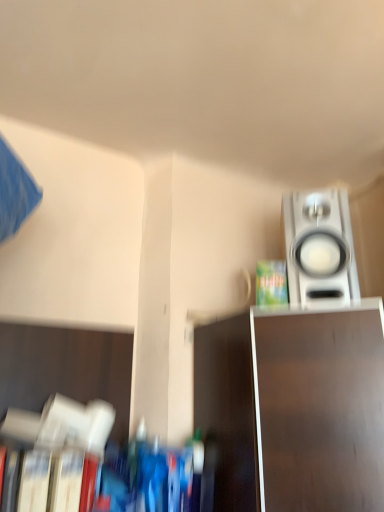
Question: From the image's perspective, is satin silver speaker at upper right over hardcover book at lower left?

Choices:
 (A) no
 (B) yes

Answer: (B)

Question: Can you confirm if satin silver speaker at upper right is thinner than hardcover book at lower left?

Choices:
 (A) yes
 (B) no

Answer: (B)

Question: Is satin silver speaker at upper right far away from hardcover book at lower left?

Choices:
 (A) yes
 (B) no

Answer: (B)

Question: From a real-world perspective, is satin silver speaker at upper right beneath hardcover book at lower left?

Choices:
 (A) no
 (B) yes

Answer: (A)

Question: Is satin silver speaker at upper right facing away from hardcover book at lower left?

Choices:
 (A) no
 (B) yes

Answer: (A)

Question: From a real-world perspective, relative to green matte paperback book at upper right, is satin silver speaker at upper right vertically above or below?

Choices:
 (A) above
 (B) below

Answer: (A)

Question: Based on their sizes in the image, would you say satin silver speaker at upper right is bigger or smaller than green matte paperback book at upper right?

Choices:
 (A) small
 (B) big

Answer: (B)

Question: From the image's perspective, is satin silver speaker at upper right located above or below green matte paperback book at upper right?

Choices:
 (A) above
 (B) below

Answer: (A)

Question: Would you say satin silver speaker at upper right is to the left or to the right of green matte paperback book at upper right in the picture?

Choices:
 (A) right
 (B) left

Answer: (A)

Question: Considering the positions of green matte paperback book at upper right and metallic silver tv stand at lower right in the image, is green matte paperback book at upper right bigger or smaller than metallic silver tv stand at lower right?

Choices:
 (A) small
 (B) big

Answer: (A)

Question: From the image's perspective, is green matte paperback book at upper right located above or below metallic silver tv stand at lower right?

Choices:
 (A) above
 (B) below

Answer: (A)

Question: Relative to metallic silver tv stand at lower right, is green matte paperback book at upper right in front or behind?

Choices:
 (A) behind
 (B) front

Answer: (A)

Question: Is green matte paperback book at upper right inside or outside of metallic silver tv stand at lower right?

Choices:
 (A) inside
 (B) outside

Answer: (B)

Question: In the image, is metallic silver tv stand at lower right positioned in front of or behind green matte paperback book at upper right?

Choices:
 (A) behind
 (B) front

Answer: (B)

Question: Choose the correct answer: Is metallic silver tv stand at lower right inside green matte paperback book at upper right or outside it?

Choices:
 (A) inside
 (B) outside

Answer: (B)